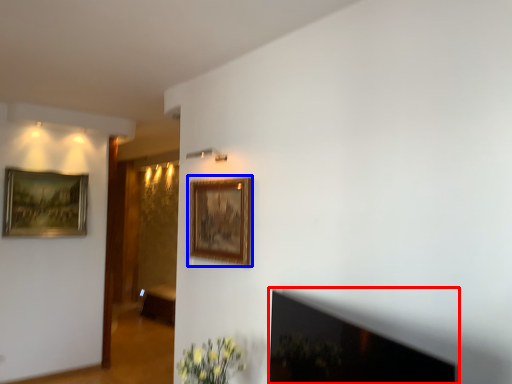
Question: Which of the following is the closest to the observer, fireplace (highlighted by a red box) or picture frame (highlighted by a blue box)?

Choices:
 (A) fireplace
 (B) picture frame

Answer: (A)